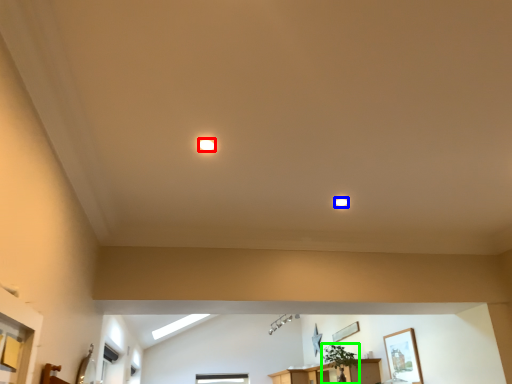
Question: Which object is positioned farthest from lighting (highlighted by a red box)? Select from lighting (highlighted by a blue box) and plant (highlighted by a green box).

Choices:
 (A) lighting
 (B) plant

Answer: (B)